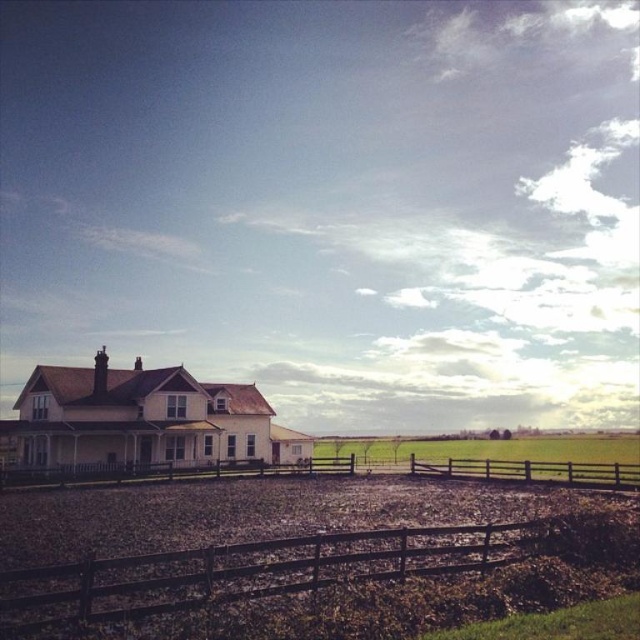
Find the location of a particular element. brown wooden fence at lower center is located at coordinates (337, 579).

Does brown wooden fence at lower center have a greater height compared to green grass at center?

No.

Who is more distant from viewer, (477, 570) or (317, 449)?

The point (317, 449) is behind.

Locate an element on the screen. This screenshot has width=640, height=640. brown wooden fence at lower center is located at coordinates (337, 579).

From the picture: Does brown wooden fence at lower center have a greater width compared to brown wooden fence at center?

In fact, brown wooden fence at lower center might be narrower than brown wooden fence at center.

Does brown wooden fence at lower center appear on the left side of brown wooden fence at center?

No, brown wooden fence at lower center is not to the left of brown wooden fence at center.

Does point (410, 579) lie behind point (136, 465)?

No, it is not.

The width and height of the screenshot is (640, 640). Find the location of `brown wooden fence at lower center`. brown wooden fence at lower center is located at coordinates (337, 579).

Is brown wooden fence at center bigger than green grass at center?

Actually, brown wooden fence at center might be smaller than green grass at center.

Locate an element on the screen. brown wooden fence at center is located at coordinates (172, 472).

Locate an element on the screen. The image size is (640, 640). brown wooden fence at center is located at coordinates (172, 472).